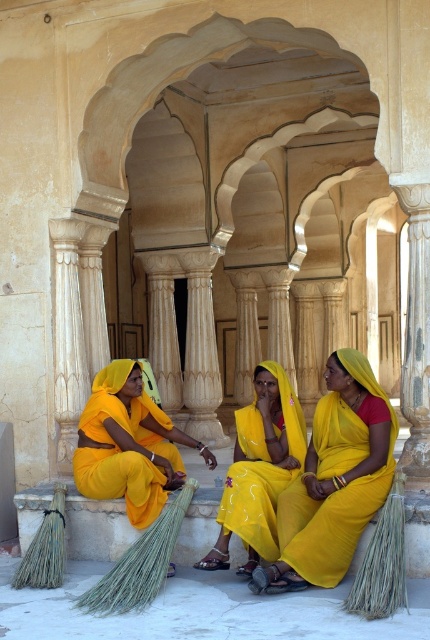
Question: Which point is closer to the camera taking this photo?

Choices:
 (A) (95, 413)
 (B) (389, 481)

Answer: (B)

Question: Which is nearer to the yellow satin saree at center?

Choices:
 (A) yellow silk saree at center
 (B) matte yellow sari at lower left

Answer: (A)

Question: Is the position of yellow satin saree at center more distant than that of matte yellow sari at lower left?

Choices:
 (A) no
 (B) yes

Answer: (A)

Question: Can you confirm if yellow silk saree at center is wider than yellow satin saree at center?

Choices:
 (A) no
 (B) yes

Answer: (B)

Question: Can you confirm if yellow silk saree at center is positioned to the right of yellow satin saree at center?

Choices:
 (A) no
 (B) yes

Answer: (B)

Question: Which point is closer to the camera?

Choices:
 (A) (183, 474)
 (B) (323, 554)
 (C) (260, 518)

Answer: (B)